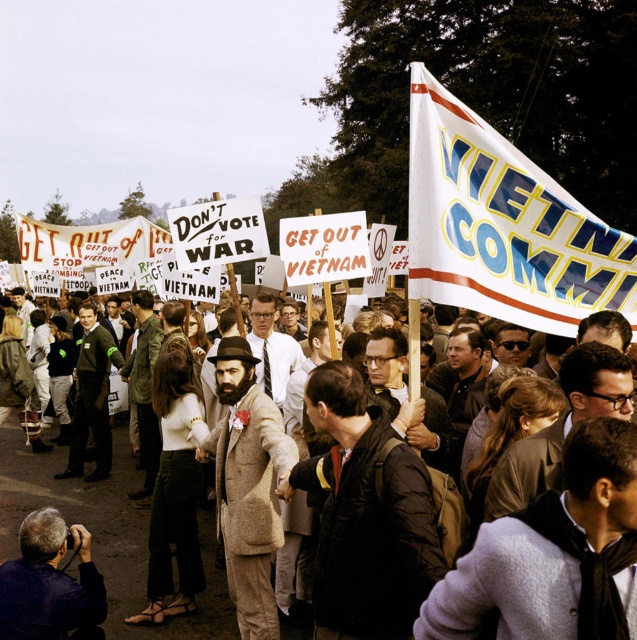
Looking at the protest scene, where is the brown wool coat at center in relation to the white paper sign at left?

The brown wool coat at center is below the white paper sign at left.

In the protest scene, there are two coats at the center of the image. The brown wool coat at center and the beige wool coat at center. Which one is smaller?

The brown wool coat at center is smaller than the beige wool coat at center.